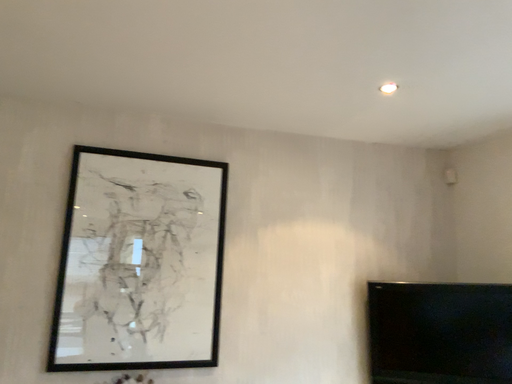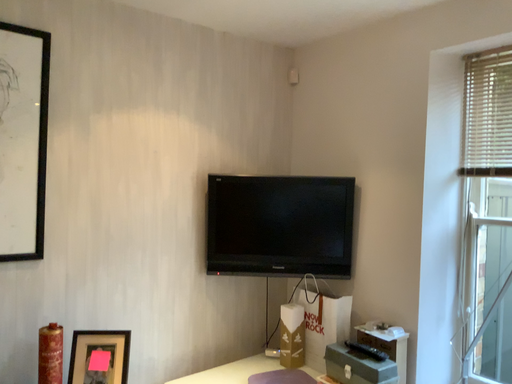
Question: How did the camera likely rotate when shooting the video?

Choices:
 (A) rotated upward
 (B) rotated downward

Answer: (B)